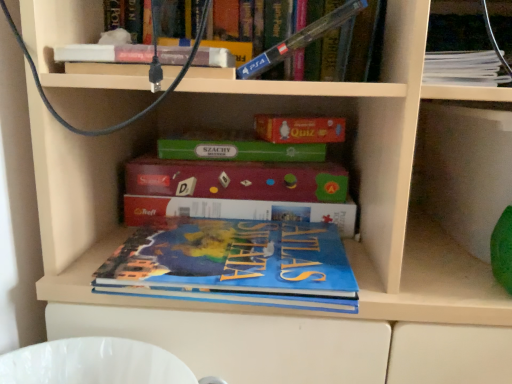
Question: Can you confirm if blue matte atlas book at center, positioned as the fourth book in top-to-bottom order, is shorter than white paper stack at upper right, which ranks as the fourth book in bottom-to-top order?

Choices:
 (A) no
 (B) yes

Answer: (B)

Question: Does blue matte atlas book at center, placed as the 1th book when sorted from bottom to top, have a larger size compared to white paper stack at upper right, which ranks as the fourth book in bottom-to-top order?

Choices:
 (A) yes
 (B) no

Answer: (A)

Question: From a real-world perspective, is blue matte atlas book at center, positioned as the fourth book in top-to-bottom order, below white paper stack at upper right, which ranks as the fourth book in bottom-to-top order?

Choices:
 (A) yes
 (B) no

Answer: (A)

Question: Considering the relative sizes of blue matte atlas book at center, positioned as the fourth book in top-to-bottom order, and white paper stack at upper right, the 1th book viewed from the top, in the image provided, is blue matte atlas book at center, positioned as the fourth book in top-to-bottom order, thinner than white paper stack at upper right, the 1th book viewed from the top,?

Choices:
 (A) yes
 (B) no

Answer: (B)

Question: Does blue matte atlas book at center, placed as the 1th book when sorted from bottom to top, have a smaller size compared to white paper stack at upper right, which ranks as the fourth book in bottom-to-top order?

Choices:
 (A) yes
 (B) no

Answer: (B)

Question: Considering the positions of point (480, 57) and point (239, 72), is point (480, 57) closer or farther from the camera than point (239, 72)?

Choices:
 (A) closer
 (B) farther

Answer: (A)

Question: Based on their sizes in the image, would you say white paper stack at upper right, which ranks as the fourth book in bottom-to-top order, is bigger or smaller than blue plastic ps4 controller at upper center, acting as the third book starting from the bottom?

Choices:
 (A) big
 (B) small

Answer: (B)

Question: Would you say white paper stack at upper right, the 1th book viewed from the top, is to the left or to the right of blue plastic ps4 controller at upper center, positioned as the second book in top-to-bottom order, in the picture?

Choices:
 (A) left
 (B) right

Answer: (B)

Question: From the image's perspective, is white paper stack at upper right, the 1th book viewed from the top, positioned above or below blue plastic ps4 controller at upper center, positioned as the second book in top-to-bottom order?

Choices:
 (A) above
 (B) below

Answer: (A)

Question: Choose the correct answer: Is blue plastic ps4 controller at upper center, acting as the third book starting from the bottom, inside white paper stack at upper right, which ranks as the fourth book in bottom-to-top order, or outside it?

Choices:
 (A) outside
 (B) inside

Answer: (A)

Question: Visually, is blue plastic ps4 controller at upper center, acting as the third book starting from the bottom, positioned to the left or to the right of white paper stack at upper right, the 1th book viewed from the top?

Choices:
 (A) right
 (B) left

Answer: (B)

Question: Looking at the image, does blue plastic ps4 controller at upper center, positioned as the second book in top-to-bottom order, seem bigger or smaller compared to white paper stack at upper right, the 1th book viewed from the top?

Choices:
 (A) big
 (B) small

Answer: (A)

Question: Does point (284, 56) appear closer or farther from the camera than point (448, 66)?

Choices:
 (A) closer
 (B) farther

Answer: (B)

Question: Do you think white paper stack at upper right, which ranks as the fourth book in bottom-to-top order, is within blue matte atlas book at center, positioned as the fourth book in top-to-bottom order, or outside of it?

Choices:
 (A) outside
 (B) inside

Answer: (A)

Question: From the image's perspective, is white paper stack at upper right, which ranks as the fourth book in bottom-to-top order, positioned above or below blue matte atlas book at center, placed as the 1th book when sorted from bottom to top?

Choices:
 (A) above
 (B) below

Answer: (A)